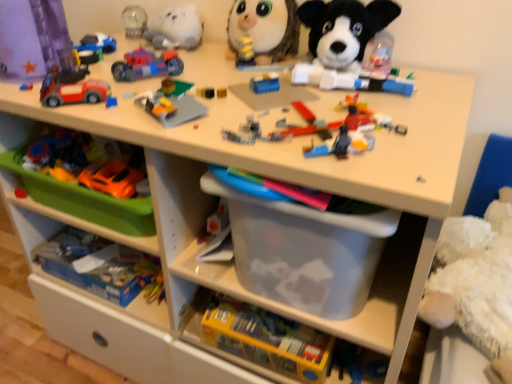
Find the location of a particular element. vacant space situated above transparent plastic storage bin at center (from a real-world perspective) is located at coordinates (233, 88).